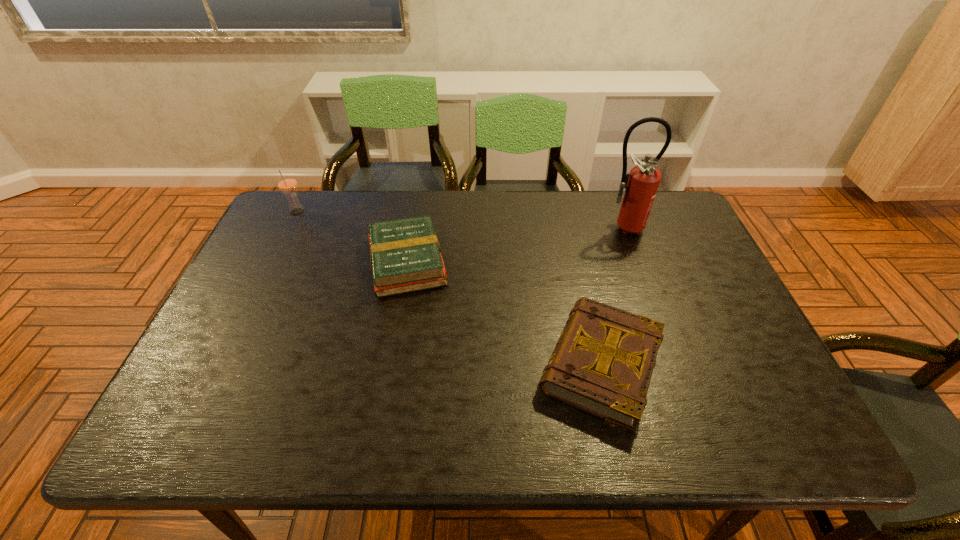
Image resolution: width=960 pixels, height=540 pixels. Identify the location of free space between the farther hardback book and the nearer hardback book. (504, 313).

Identify the location of empty location between the fire extinguisher and the left hardback book. (515, 245).

Image resolution: width=960 pixels, height=540 pixels. In order to click on unoccupied area between the tallest object and the third object from right to left in this screenshot , I will do `click(515, 245)`.

At what (x,y) coordinates should I click in order to perform the action: click on the closest object relative to the straw. Please return your answer as a coordinate pair (x, y). Looking at the image, I should click on (405, 254).

Select which object appears as the second closest to the nearest object. Please provide its 2D coordinates. Your answer should be formatted as a tuple, i.e. [(x, y)], where the tuple contains the x and y coordinates of a point satisfying the conditions above.

[(641, 184)]

Identify the location of vacant area in the image that satisfies the following two spatial constraints: 1. on the front side of the third object from right to left; 2. on the left side of the leftmost object. [273, 262].